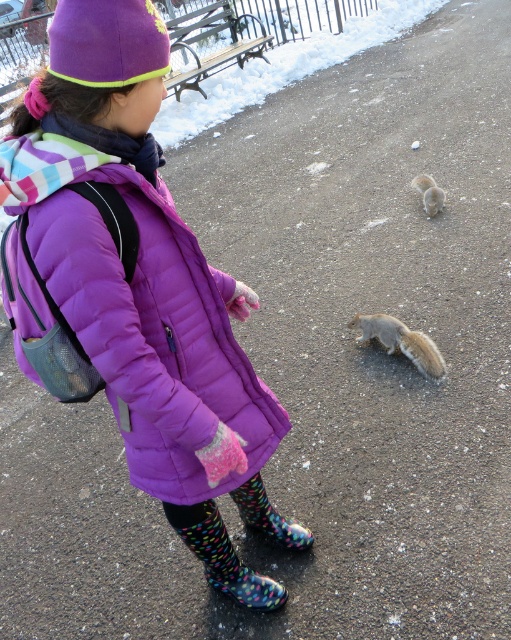
Is gray furry squirrel at center closer to camera compared to fuzzy gray squirrel at lower center?

Yes, it is.

Is point (409, 356) positioned before point (432, 182)?

Yes.

Where is `gray furry squirrel at center`? The image size is (511, 640). gray furry squirrel at center is located at coordinates (402, 340).

Who is shorter, gray furry squirrel at center or multicolored rubber boot at lower center?

With less height is multicolored rubber boot at lower center.

Who is lower down, gray furry squirrel at center or multicolored rubber boot at lower center?

multicolored rubber boot at lower center

Locate an element on the screen. Image resolution: width=511 pixels, height=640 pixels. gray furry squirrel at center is located at coordinates (402, 340).

Find the location of a particular element. gray furry squirrel at center is located at coordinates (402, 340).

Is point (252, 499) farther from viewer compared to point (414, 177)?

No, (252, 499) is in front of (414, 177).

The image size is (511, 640). I want to click on multicolored rubber boot at lower center, so click(268, 515).